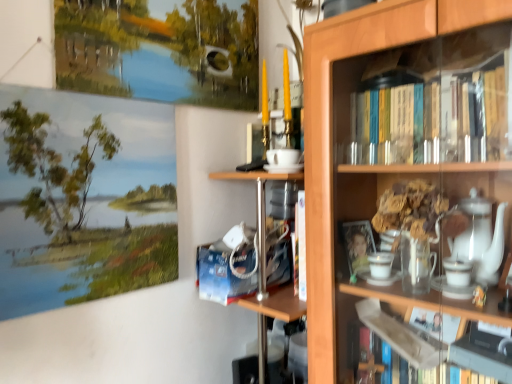
Question: Based on their positions, is wooden bookcase at upper right located to the left or right of oil painting landscape at upper left?

Choices:
 (A) left
 (B) right

Answer: (B)

Question: Is wooden bookcase at upper right situated inside oil painting landscape at upper left or outside?

Choices:
 (A) inside
 (B) outside

Answer: (B)

Question: From the image's perspective, is wooden bookcase at upper right above or below oil painting landscape at upper left?

Choices:
 (A) below
 (B) above

Answer: (A)

Question: Is point (146, 178) closer or farther from the camera than point (309, 286)?

Choices:
 (A) farther
 (B) closer

Answer: (A)

Question: Visually, is oil painting landscape at upper left positioned to the left or to the right of wooden bookcase at upper right?

Choices:
 (A) right
 (B) left

Answer: (B)

Question: From the image's perspective, is oil painting landscape at upper left located above or below wooden bookcase at upper right?

Choices:
 (A) below
 (B) above

Answer: (B)

Question: Based on their sizes in the image, would you say oil painting landscape at upper left is bigger or smaller than wooden bookcase at upper right?

Choices:
 (A) small
 (B) big

Answer: (A)